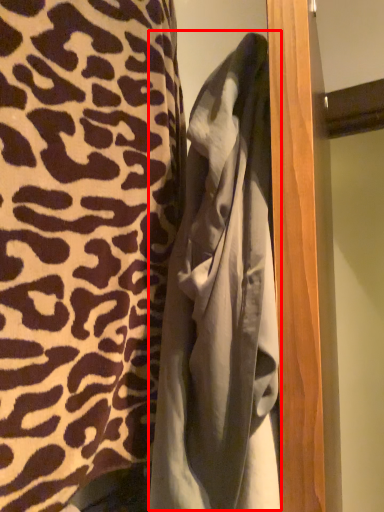
Question: From the image's perspective, considering the relative positions of bathrobe (annotated by the red box) and curtain in the image provided, where is bathrobe (annotated by the red box) located with respect to the staircase?

Choices:
 (A) below
 (B) above

Answer: (A)